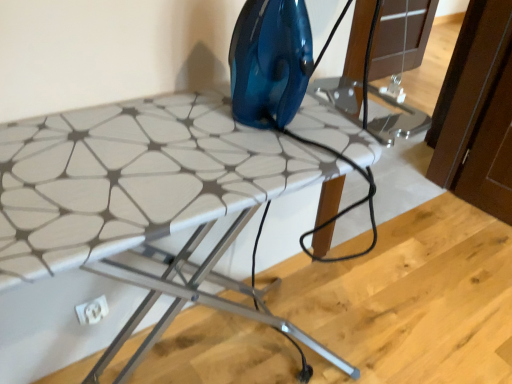
Image resolution: width=512 pixels, height=384 pixels. In order to click on white plastic electric outlet at lower left in this screenshot , I will do pos(92,311).

The width and height of the screenshot is (512, 384). Describe the element at coordinates (92, 311) in the screenshot. I see `white plastic electric outlet at lower left` at that location.

At what (x,y) coordinates should I click in order to perform the action: click on white textured ironing board at center. Please return your answer as a coordinate pair (x, y). The height and width of the screenshot is (384, 512). Looking at the image, I should click on (145, 198).

What do you see at coordinates (145, 198) in the screenshot? The width and height of the screenshot is (512, 384). I see `white textured ironing board at center` at bounding box center [145, 198].

Find the location of a particular element. The height and width of the screenshot is (384, 512). white plastic electric outlet at lower left is located at coordinates (92, 311).

Considering the positions of objects white textured ironing board at center and white plastic electric outlet at lower left in the image provided, who is more to the left, white textured ironing board at center or white plastic electric outlet at lower left?

white plastic electric outlet at lower left.

Is white textured ironing board at center in front of or behind white plastic electric outlet at lower left in the image?

Visually, white textured ironing board at center is located in front of white plastic electric outlet at lower left.

Which point is more distant from viewer, (120, 381) or (101, 312)?

Point (101, 312)

From the image's perspective, is white textured ironing board at center below white plastic electric outlet at lower left?

No, from the image's perspective, white textured ironing board at center is not beneath white plastic electric outlet at lower left.

From a real-world perspective, is white textured ironing board at center positioned above or below white plastic electric outlet at lower left?

In terms of real-world spatial position, white textured ironing board at center is above white plastic electric outlet at lower left.

Can you confirm if white textured ironing board at center is wider than white plastic electric outlet at lower left?

Yes, white textured ironing board at center is wider than white plastic electric outlet at lower left.

Between white textured ironing board at center and white plastic electric outlet at lower left, which one has less height?

Standing shorter between the two is white plastic electric outlet at lower left.

Between white textured ironing board at center and white plastic electric outlet at lower left, which one has larger size?

Bigger between the two is white textured ironing board at center.

Is white textured ironing board at center inside the boundaries of white plastic electric outlet at lower left, or outside?

white textured ironing board at center is not enclosed by white plastic electric outlet at lower left.

Would you consider white textured ironing board at center to be distant from white plastic electric outlet at lower left?

No.

Is white textured ironing board at center oriented towards white plastic electric outlet at lower left?

Yes, white textured ironing board at center is turned towards white plastic electric outlet at lower left.

Where is `electric outlet below the white textured ironing board at center (from a real-world perspective)`? This screenshot has height=384, width=512. electric outlet below the white textured ironing board at center (from a real-world perspective) is located at coordinates (92, 311).

Which object is positioned more to the left, white plastic electric outlet at lower left or white textured ironing board at center?

white plastic electric outlet at lower left.

Which object is further away from the camera taking this photo, white plastic electric outlet at lower left or white textured ironing board at center?

white plastic electric outlet at lower left is behind.

Is point (104, 297) behind point (224, 134)?

Yes, point (104, 297) is farther from viewer.

From the image's perspective, who appears lower, white plastic electric outlet at lower left or white textured ironing board at center?

From the image's view, white plastic electric outlet at lower left is below.

From a real-world perspective, is white plastic electric outlet at lower left below white textured ironing board at center?

Yes, from a real-world perspective, white plastic electric outlet at lower left is beneath white textured ironing board at center.

Looking at this image, does white plastic electric outlet at lower left have a greater width compared to white textured ironing board at center?

In fact, white plastic electric outlet at lower left might be narrower than white textured ironing board at center.

Considering the relative sizes of white plastic electric outlet at lower left and white textured ironing board at center in the image provided, is white plastic electric outlet at lower left taller than white textured ironing board at center?

No, white plastic electric outlet at lower left is not taller than white textured ironing board at center.

Considering the sizes of objects white plastic electric outlet at lower left and white textured ironing board at center in the image provided, who is smaller, white plastic electric outlet at lower left or white textured ironing board at center?

white plastic electric outlet at lower left.

Is white plastic electric outlet at lower left not inside white textured ironing board at center?

Actually, white plastic electric outlet at lower left is at least partially inside white textured ironing board at center.

Is the surface of white plastic electric outlet at lower left in direct contact with white textured ironing board at center?

No, white plastic electric outlet at lower left is not with white textured ironing board at center.

Is white plastic electric outlet at lower left looking in the opposite direction of white textured ironing board at center?

No, white plastic electric outlet at lower left is not facing the opposite direction of white textured ironing board at center.

You are a GUI agent. You are given a task and a screenshot of the screen. Output one action in this format:
    pyautogui.click(x=<x>, y=<y>)
    Task: Click on the table in front of the white plastic electric outlet at lower left
    
    Given the screenshot: What is the action you would take?
    pyautogui.click(x=145, y=198)

The width and height of the screenshot is (512, 384). In the image, there is a white textured ironing board at center. What are the coordinates of `electric outlet below it (from a real-world perspective)` in the screenshot? It's located at (92, 311).

Find the location of a particular element. table in front of the white plastic electric outlet at lower left is located at coordinates (145, 198).